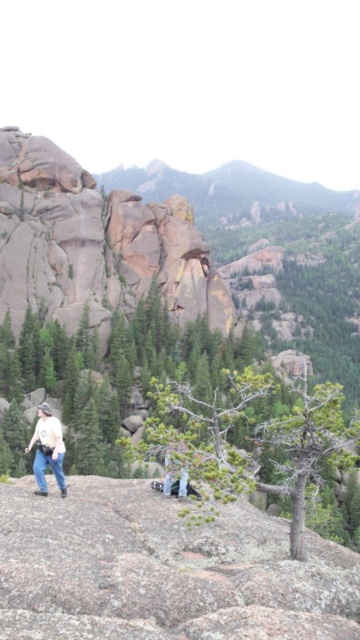
Can you confirm if green matte tree at center is positioned to the right of light beige shirt at lower left?

Indeed, green matte tree at center is positioned on the right side of light beige shirt at lower left.

Is green matte tree at center in front of light beige shirt at lower left?

Yes, green matte tree at center is in front of light beige shirt at lower left.

Who is more distant from viewer, (169, 490) or (60, 474)?

The point (169, 490) is more distant.

Identify the location of green matte tree at center. This screenshot has height=640, width=360. (249, 440).